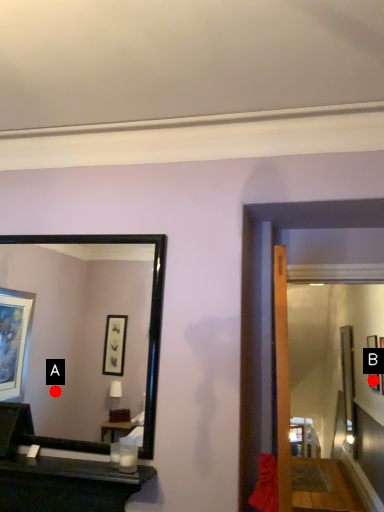
Question: Two points are circled on the image, labeled by A and B beside each circle. Which of the following is the closest to the observer?

Choices:
 (A) A is closer
 (B) B is closer

Answer: (B)